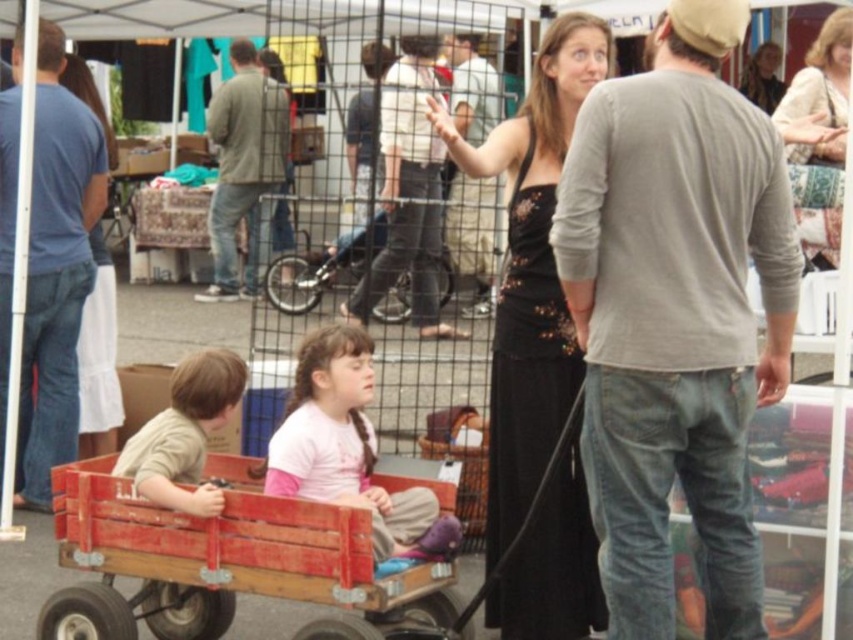
You are a customer at the market and see both the gray cotton shirt at center and the green cotton shirt at center. Which one is positioned lower in the image?

The gray cotton shirt at center is positioned below the green cotton shirt at center, so it is lower in the image.

You are a photographer trying to capture both the black lace dress at center and the black lace dress at upper center in a single shot. Which dress will appear larger in your photo?

The black lace dress at center will appear larger in the photo because it is closer to the viewer compared to the black lace dress at upper center.

You are a tailor who needs to determine which clothing item requires more fabric for alterations. Based on the scene, which item would need more fabric, the gray cotton shirt at center or the black lace dress at upper center?

The gray cotton shirt at center has a larger size compared to the black lace dress at upper center, so it would require more fabric for alterations.